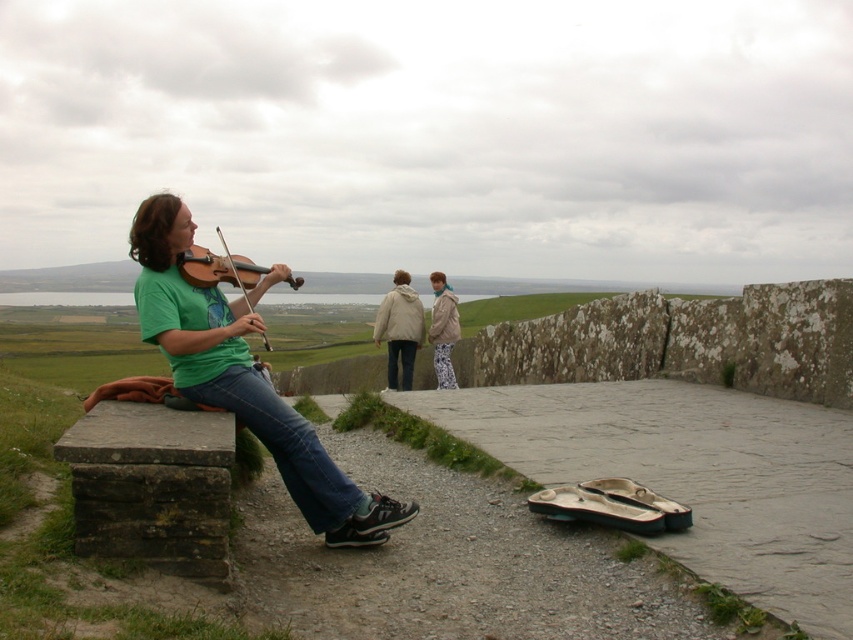
Question: Among these objects, which one is farthest from the camera?

Choices:
 (A) green matte shirt at left
 (B) blue denim jeans at center

Answer: (B)

Question: Is blue denim jeans at lower left to the right of blue denim jeans at center from the viewer's perspective?

Choices:
 (A) no
 (B) yes

Answer: (A)

Question: Estimate the real-world distances between objects in this image. Which object is closer to the patterned fabric jacket at center?

Choices:
 (A) blue denim jeans at center
 (B) green matte shirt at left

Answer: (A)

Question: Does blue denim jeans at lower left appear on the right side of patterned fabric jacket at center?

Choices:
 (A) yes
 (B) no

Answer: (B)

Question: From the image, what is the correct spatial relationship of light beige jacket at center in relation to wooden violin at left?

Choices:
 (A) left
 (B) right

Answer: (B)

Question: Which object is farther from the camera taking this photo?

Choices:
 (A) patterned fabric jacket at center
 (B) jeans at center

Answer: (A)